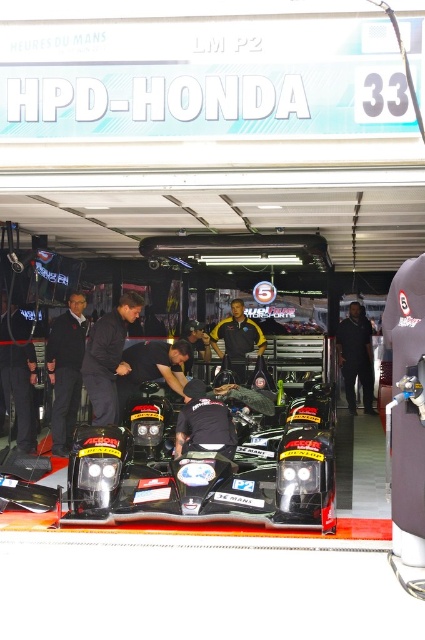
Question: Can you confirm if black carbon fiber race car at center is thinner than dark blue fabric jacket at center?

Choices:
 (A) yes
 (B) no

Answer: (B)

Question: Which object is farther from the camera taking this photo?

Choices:
 (A) black carbon fiber race car at center
 (B) yellow fabric shirt at center
 (C) black fabric man at center

Answer: (C)

Question: Which object is positioned farthest from the dark gray suit at center?

Choices:
 (A) yellow fabric shirt at center
 (B) black fabric shirt at center

Answer: (B)

Question: Does black carbon fiber race car at center have a greater width compared to black fabric shirt at center?

Choices:
 (A) no
 (B) yes

Answer: (B)

Question: Among these objects, which one is farthest from the camera?

Choices:
 (A) dark gray suit at center
 (B) yellow fabric shirt at center
 (C) black fabric shirt at center
 (D) dark blue fabric jacket at center

Answer: (C)

Question: Does dark blue fabric jacket at center appear on the right side of yellow fabric shirt at center?

Choices:
 (A) yes
 (B) no

Answer: (B)